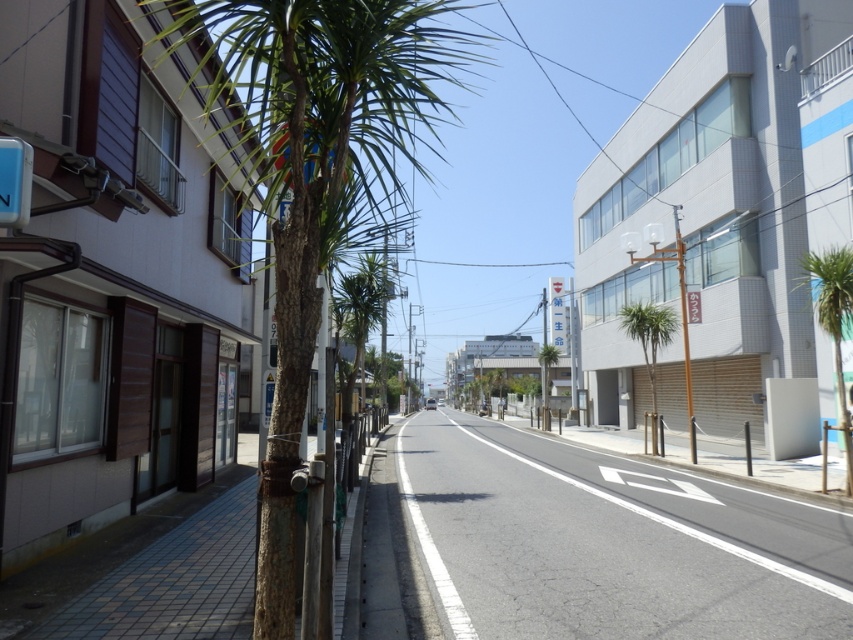
Is brown brick pavement at lower left shorter than green leafy palm tree at center-right?

Yes, brown brick pavement at lower left is shorter than green leafy palm tree at center-right.

Which is below, brown brick pavement at lower left or green leafy palm tree at center-right?

brown brick pavement at lower left is lower down.

Is point (215, 627) farther from viewer compared to point (631, 314)?

That is False.

You are a GUI agent. You are given a task and a screenshot of the screen. Output one action in this format:
    pyautogui.click(x=<x>, y=<y>)
    Task: Click on the brown brick pavement at lower left
    Image resolution: width=853 pixels, height=640 pixels.
    Given the screenshot: What is the action you would take?
    pyautogui.click(x=172, y=582)

Where is `gray asphalt road at center`? gray asphalt road at center is located at coordinates pyautogui.click(x=611, y=544).

Between gray asphalt road at center and green leafy palm tree at right, which one is positioned lower?

gray asphalt road at center is below.

Describe the element at coordinates (611, 544) in the screenshot. This screenshot has height=640, width=853. I see `gray asphalt road at center` at that location.

Where is `gray asphalt road at center`? Image resolution: width=853 pixels, height=640 pixels. gray asphalt road at center is located at coordinates (611, 544).

Is green textured palm tree at left below green leafy palm tree at center-right?

No, green textured palm tree at left is not below green leafy palm tree at center-right.

Between point (323, 196) and point (624, 307), which one is positioned behind?

Positioned behind is point (624, 307).

Is point (335, 234) farther from viewer compared to point (669, 337)?

That is False.

Image resolution: width=853 pixels, height=640 pixels. Find the location of `green textured palm tree at left`. green textured palm tree at left is located at coordinates (317, 177).